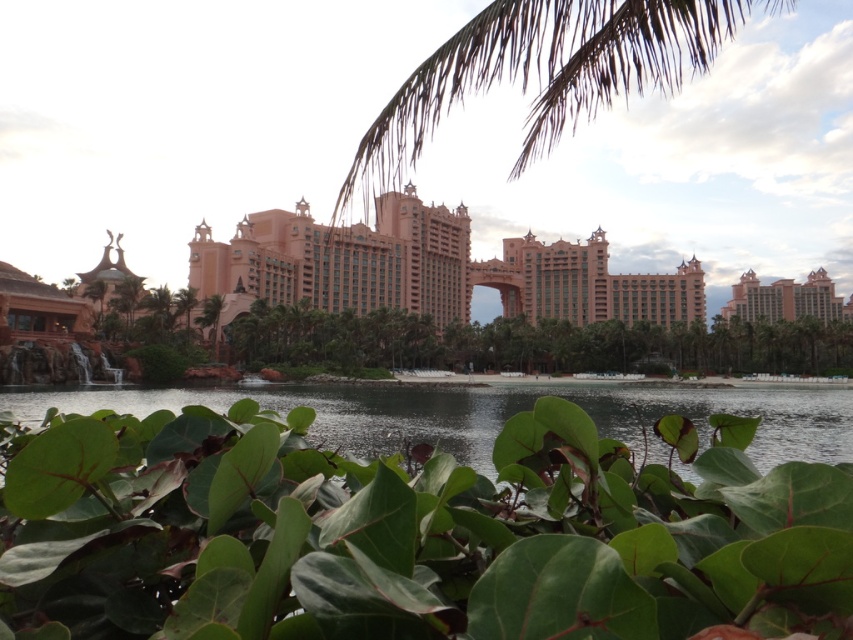
Question: Which point appears farthest from the camera in this image?

Choices:
 (A) (119, 428)
 (B) (384, 412)
 (C) (476, 90)

Answer: (C)

Question: Which object is the closest to the green leafy palm tree at upper center?

Choices:
 (A) transparent water at center
 (B) green matte leaves at lower center

Answer: (B)

Question: Is green matte leaves at lower center wider than green leafy palm tree at upper center?

Choices:
 (A) yes
 (B) no

Answer: (B)

Question: Which of the following is the closest to the observer?

Choices:
 (A) (672, 61)
 (B) (252, 605)

Answer: (B)

Question: Can you confirm if green leafy palm tree at upper center is smaller than transparent water at center?

Choices:
 (A) no
 (B) yes

Answer: (A)

Question: Does green matte leaves at lower center appear on the left side of transparent water at center?

Choices:
 (A) yes
 (B) no

Answer: (A)